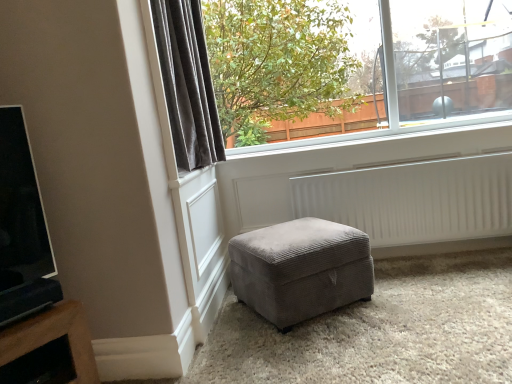
Question: From the image's perspective, is velvet gray curtain at upper left below velvet grey ottoman at center?

Choices:
 (A) no
 (B) yes

Answer: (A)

Question: Is velvet grey ottoman at center at the back of velvet gray curtain at upper left?

Choices:
 (A) yes
 (B) no

Answer: (B)

Question: Does velvet gray curtain at upper left touch velvet grey ottoman at center?

Choices:
 (A) no
 (B) yes

Answer: (A)

Question: Are velvet gray curtain at upper left and velvet grey ottoman at center far apart?

Choices:
 (A) no
 (B) yes

Answer: (A)

Question: Can you confirm if velvet gray curtain at upper left is shorter than velvet grey ottoman at center?

Choices:
 (A) no
 (B) yes

Answer: (A)

Question: Can we say velvet gray curtain at upper left lies outside velvet grey ottoman at center?

Choices:
 (A) no
 (B) yes

Answer: (B)

Question: From a real-world perspective, is velvet grey ottoman at center positioned under velvet gray curtain at upper left based on gravity?

Choices:
 (A) no
 (B) yes

Answer: (B)

Question: Does velvet grey ottoman at center have a greater height compared to velvet gray curtain at upper left?

Choices:
 (A) yes
 (B) no

Answer: (B)

Question: Is velvet grey ottoman at center not near velvet gray curtain at upper left?

Choices:
 (A) yes
 (B) no

Answer: (B)

Question: Considering the relative sizes of velvet grey ottoman at center and velvet gray curtain at upper left in the image provided, is velvet grey ottoman at center shorter than velvet gray curtain at upper left?

Choices:
 (A) no
 (B) yes

Answer: (B)

Question: Is velvet grey ottoman at center in front of velvet gray curtain at upper left?

Choices:
 (A) no
 (B) yes

Answer: (A)

Question: Considering the relative sizes of velvet grey ottoman at center and velvet gray curtain at upper left in the image provided, is velvet grey ottoman at center wider than velvet gray curtain at upper left?

Choices:
 (A) no
 (B) yes

Answer: (B)

Question: From a real-world perspective, is velvet gray curtain at upper left located beneath clear glass window at upper center?

Choices:
 (A) no
 (B) yes

Answer: (B)